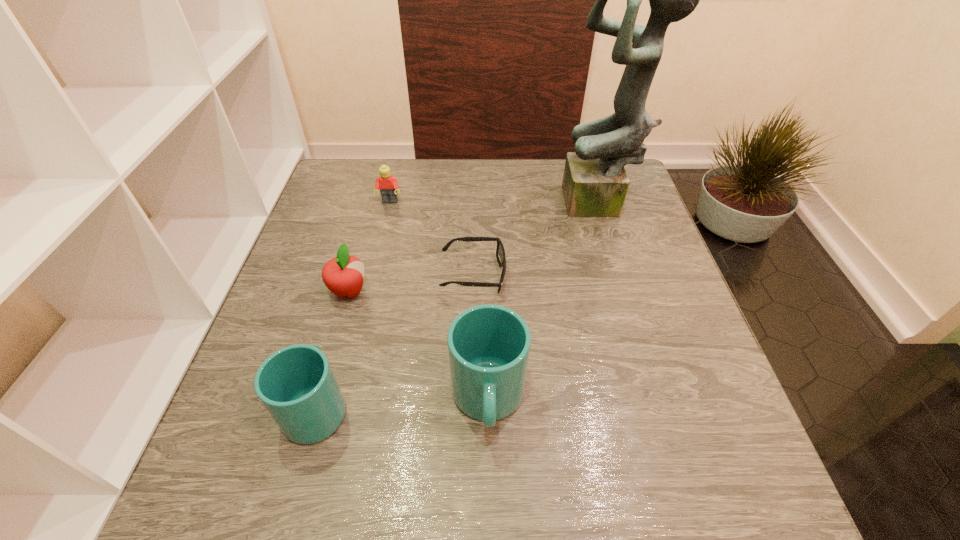
All cups are currently evenly spaced. To continue this pattern, where would you add another cup on the right? Please point out a vacant spot. Please provide its 2D coordinates. Your answer should be formatted as a tuple, i.e. [(x, y)], where the tuple contains the x and y coordinates of a point satisfying the conditions above.

[(656, 395)]